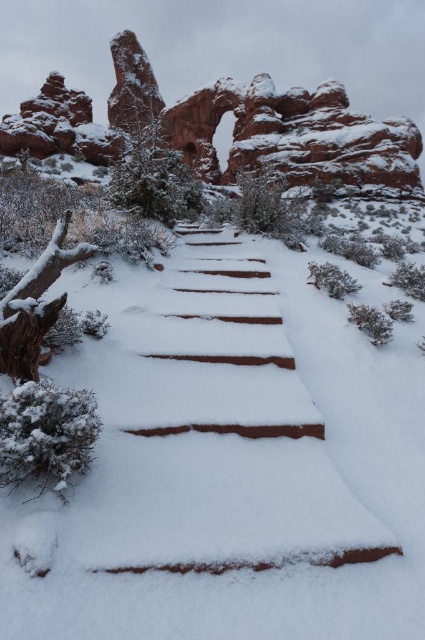
Question: Is snow-covered stone stairs at center bigger than reddish-brown textured rock formation at upper center?

Choices:
 (A) no
 (B) yes

Answer: (A)

Question: Does snow-covered stone stairs at center lie in front of reddish-brown textured rock formation at upper center?

Choices:
 (A) no
 (B) yes

Answer: (B)

Question: Which point is farther to the camera?

Choices:
 (A) (235, 445)
 (B) (159, 93)

Answer: (B)

Question: Does snow-covered stone stairs at center appear under reddish-brown textured rock formation at upper center?

Choices:
 (A) no
 (B) yes

Answer: (B)

Question: Which of the following is the closest to the observer?

Choices:
 (A) (116, 74)
 (B) (122, 369)

Answer: (B)